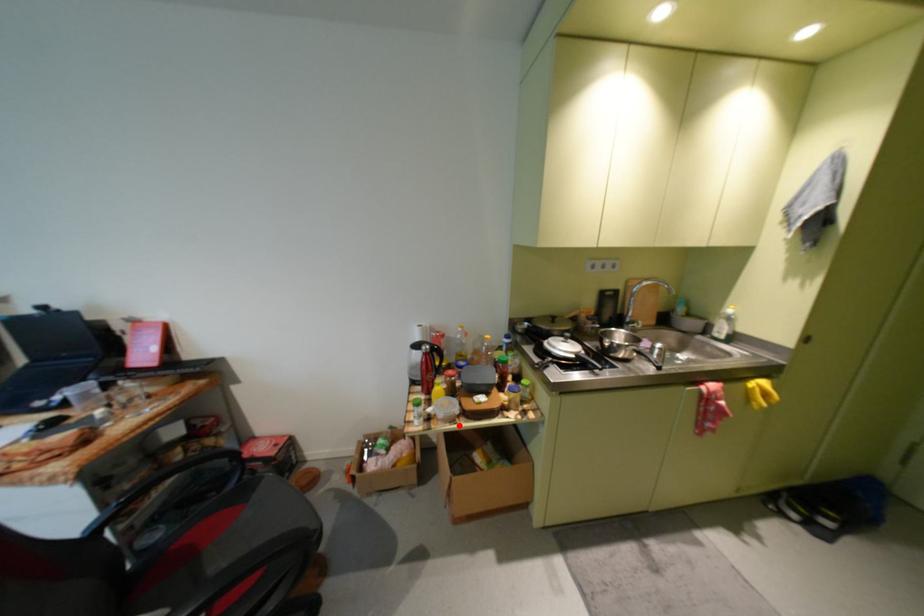
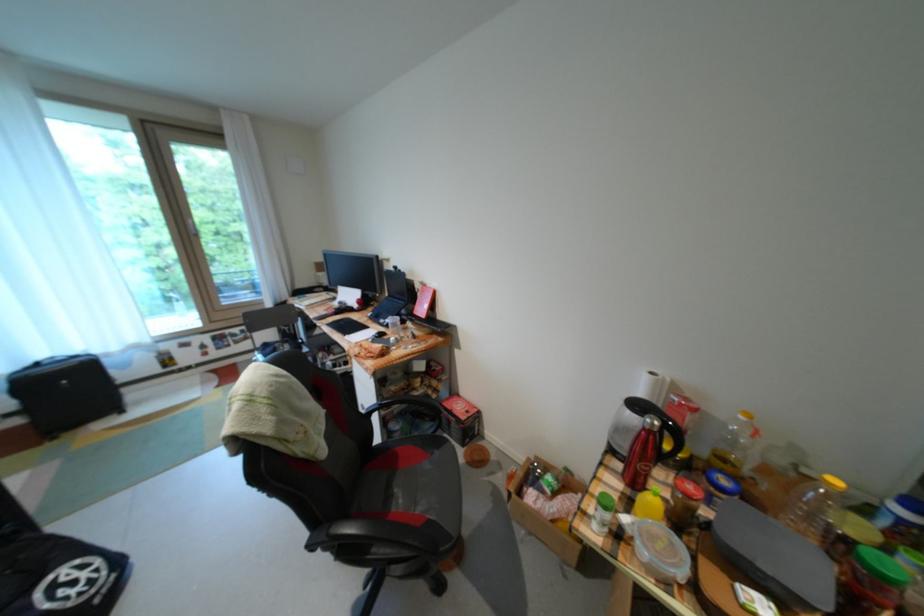
Question: I am providing you with two images of the same scene from different viewpoints. A red point is marked on the first image. Is the red point's position out of view in image 2?

Choices:
 (A) Yes
 (B) No

Answer: (B)